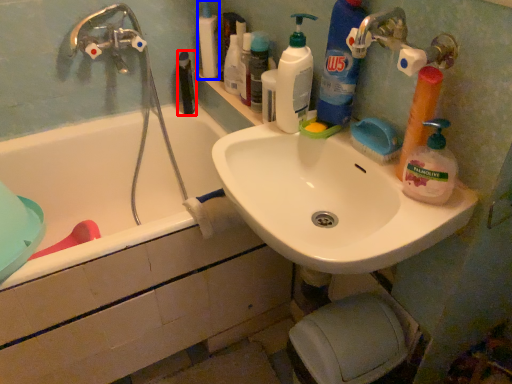
Question: Which point is closer to the camera, mouthwash (highlighted by a red box) or toiletry (highlighted by a blue box)?

Choices:
 (A) mouthwash
 (B) toiletry

Answer: (B)